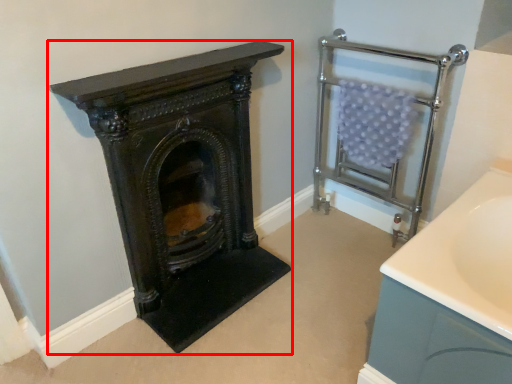
Question: From the image's perspective, where is wood burning stove (annotated by the red box) located in relation to balustrade in the image?

Choices:
 (A) below
 (B) above

Answer: (A)